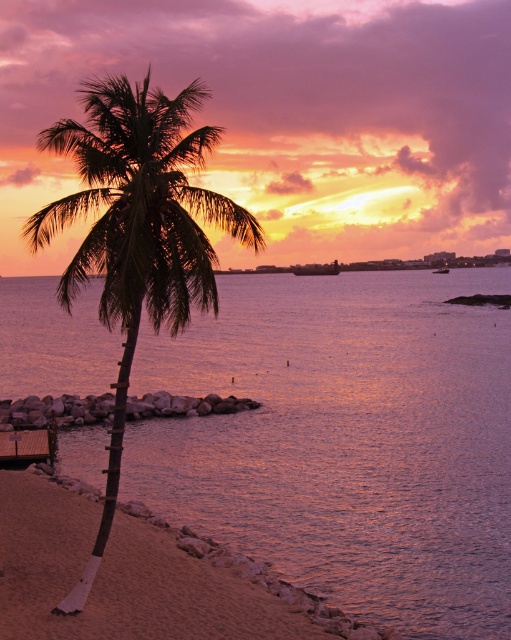
You are standing on the beach and looking at the purple reflective water at center and the green leafy palm tree at left. Which object is closer to the horizon?

The purple reflective water at center is closer to the horizon than the green leafy palm tree at left because it is positioned below the palm tree, which places it further out in the scene.

You are standing on the beach and want to walk towards the purple reflective water at center and the green leafy palm tree at left. Which object will you encounter first?

You will encounter the purple reflective water at center first because it is closer to you than the green leafy palm tree at left, which is further away.